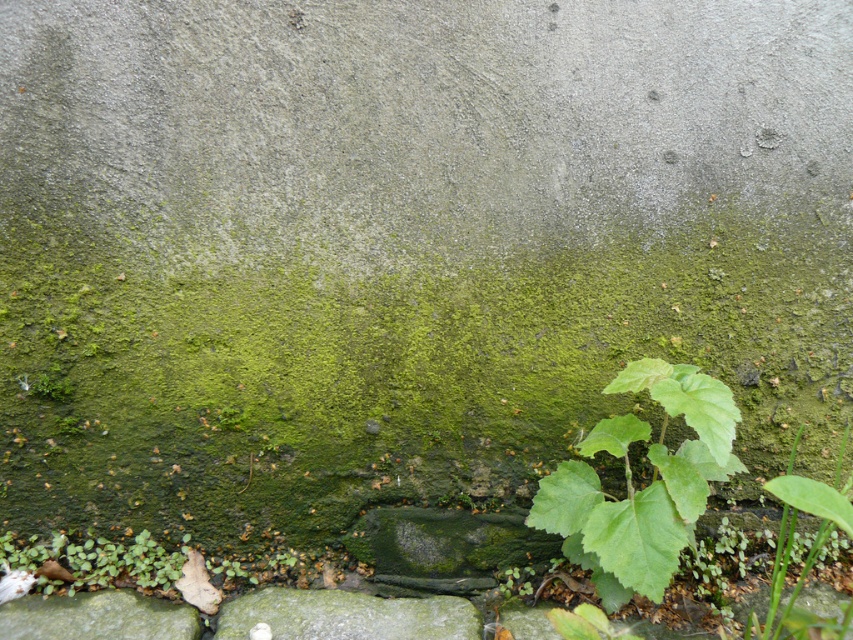
Consider the image. Can you confirm if green mossy concrete at lower center is positioned below green mossy rock at lower left?

No, green mossy concrete at lower center is not below green mossy rock at lower left.

Is point (408, 168) more distant than point (142, 602)?

No, it is in front of (142, 602).

Does point (299, 13) come closer to viewer compared to point (47, 608)?

Yes, point (299, 13) is in front of point (47, 608).

The image size is (853, 640). I want to click on green mossy concrete at lower center, so click(x=416, y=124).

Is green leafy plant at lower right positioned before gray stone at lower center?

Yes, it is.

Image resolution: width=853 pixels, height=640 pixels. In order to click on green leafy plant at lower right in this screenshot , I will do `click(643, 486)`.

Find the location of a particular element. green leafy plant at lower right is located at coordinates (643, 486).

Between point (437, 611) and point (109, 620), which one is positioned in front?

Positioned in front is point (109, 620).

Which is more to the right, gray stone at lower center or green mossy rock at lower left?

gray stone at lower center

Which is behind, point (477, 634) or point (32, 625)?

Point (477, 634)

This screenshot has width=853, height=640. What are the coordinates of `gray stone at lower center` in the screenshot? It's located at (347, 616).